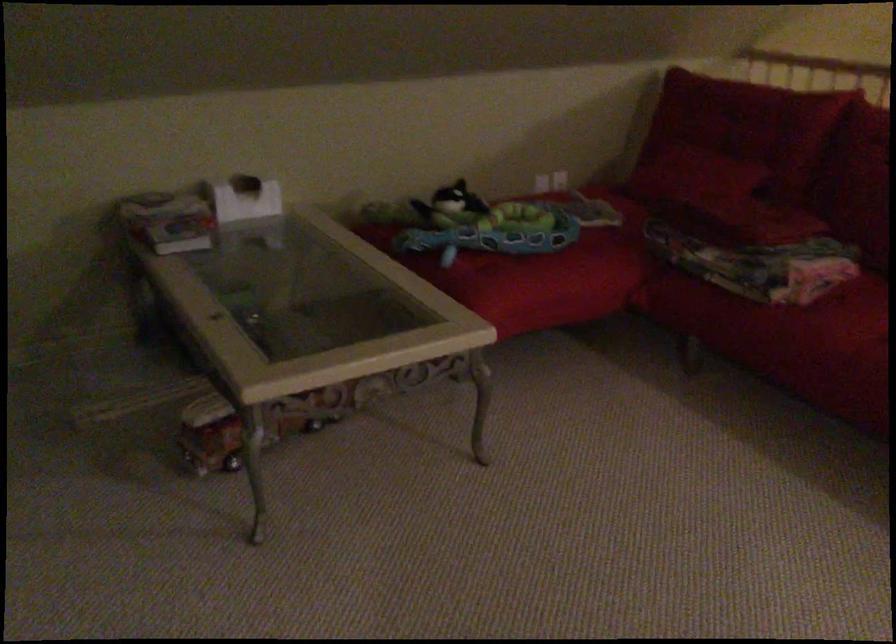
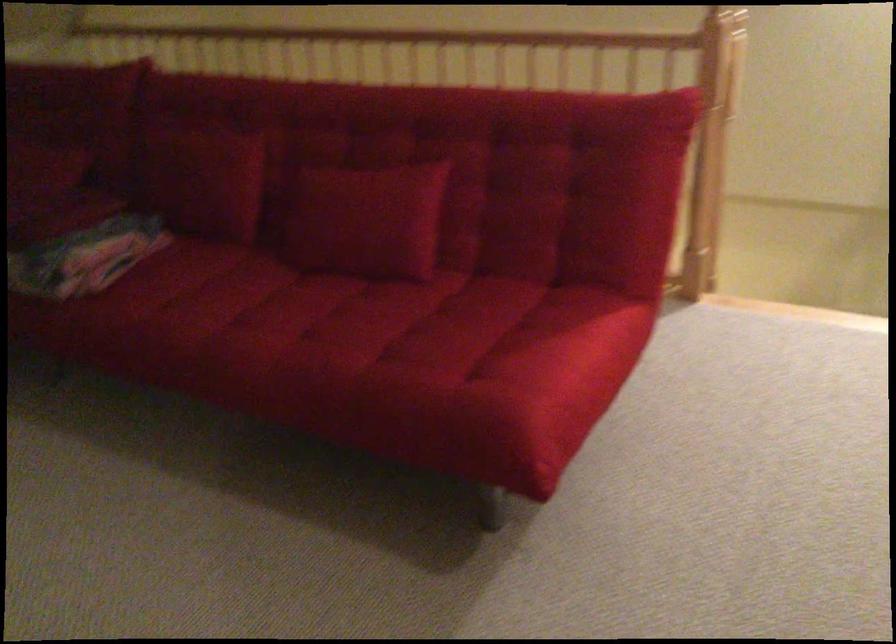
Question: How did the camera likely rotate?

Choices:
 (A) Left
 (B) Right
 (C) Up
 (D) Down

Answer: (B)